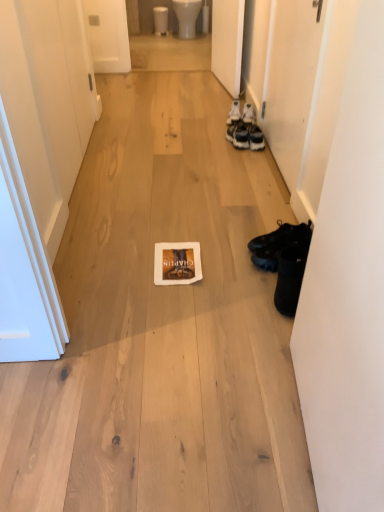
Question: Is the depth of black leather shoes at lower right, arranged as the 1th footwear when ordered from the bottom, less than that of black leather shoes at right, which ranks as the 2th footwear in front-to-back order?

Choices:
 (A) yes
 (B) no

Answer: (A)

Question: From a real-world perspective, is black leather shoes at lower right, placed as the third footwear when sorted from back to front, positioned under black leather shoes at right, acting as the 2th footwear starting from the top, based on gravity?

Choices:
 (A) no
 (B) yes

Answer: (A)

Question: From the image's perspective, would you say black leather shoes at lower right, arranged as the 1th footwear when ordered from the bottom, is shown under black leather shoes at right, acting as the 2th footwear starting from the bottom?

Choices:
 (A) no
 (B) yes

Answer: (B)

Question: Does black leather shoes at lower right, placed as the third footwear when sorted from back to front, have a larger size compared to black leather shoes at right, which ranks as the 2th footwear in front-to-back order?

Choices:
 (A) yes
 (B) no

Answer: (A)

Question: Can you confirm if black leather shoes at lower right, which is counted as the third footwear, starting from the top, is shorter than black leather shoes at right, the 2th footwear from the back?

Choices:
 (A) no
 (B) yes

Answer: (A)

Question: Visually, is black leather shoes at lower right, which is the first footwear from front to back, positioned to the left or to the right of white leather sneakers at right, the third footwear in the front-to-back sequence?

Choices:
 (A) right
 (B) left

Answer: (A)

Question: In terms of width, does black leather shoes at lower right, placed as the third footwear when sorted from back to front, look wider or thinner when compared to white leather sneakers at right, the 1th footwear from the back?

Choices:
 (A) wide
 (B) thin

Answer: (B)

Question: Considering the positions of black leather shoes at lower right, placed as the third footwear when sorted from back to front, and white leather sneakers at right, the third footwear in the front-to-back sequence, in the image, is black leather shoes at lower right, placed as the third footwear when sorted from back to front, taller or shorter than white leather sneakers at right, the third footwear in the front-to-back sequence,?

Choices:
 (A) tall
 (B) short

Answer: (A)

Question: Considering their positions, is black leather shoes at lower right, which is counted as the third footwear, starting from the top, located in front of or behind white leather sneakers at right, the 1th footwear from the back?

Choices:
 (A) behind
 (B) front

Answer: (B)

Question: Looking at their shapes, would you say black leather shoes at lower right, which is the first footwear from front to back, is wider or thinner than white matte door at upper right, marked as the 2th door in a left-to-right arrangement?

Choices:
 (A) wide
 (B) thin

Answer: (A)

Question: From a real-world perspective, is black leather shoes at lower right, placed as the third footwear when sorted from back to front, above or below white matte door at upper right, marked as the 2th door in a right-to-left arrangement?

Choices:
 (A) above
 (B) below

Answer: (B)

Question: Is black leather shoes at lower right, arranged as the 1th footwear when ordered from the bottom, inside or outside of white matte door at upper right, marked as the 2th door in a left-to-right arrangement?

Choices:
 (A) outside
 (B) inside

Answer: (A)

Question: Based on their sizes in the image, would you say black leather shoes at lower right, placed as the third footwear when sorted from back to front, is bigger or smaller than white matte door at upper right, marked as the 2th door in a left-to-right arrangement?

Choices:
 (A) big
 (B) small

Answer: (B)

Question: Looking at the image, does white leather sneakers at right, which is the third footwear from bottom to top, seem bigger or smaller compared to white glossy toilet bowl at upper center, which is the first toilet bowl from right to left?

Choices:
 (A) small
 (B) big

Answer: (A)

Question: From a real-world perspective, relative to white glossy toilet bowl at upper center, which is the 2th toilet bowl from left to right, is white leather sneakers at right, the 1th footwear from the back, vertically above or below?

Choices:
 (A) below
 (B) above

Answer: (A)